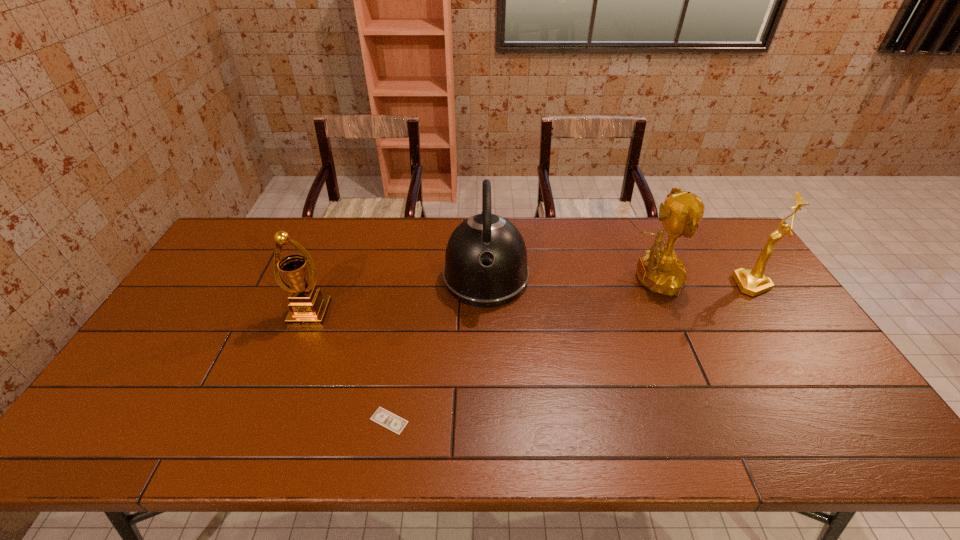
Locate an element on the screen. This screenshot has width=960, height=540. vacant space at the near edge of the desktop is located at coordinates (588, 432).

Identify the location of vacant area at the left edge. The width and height of the screenshot is (960, 540). (214, 302).

Where is `free location at the right edge`? Image resolution: width=960 pixels, height=540 pixels. free location at the right edge is located at coordinates (746, 325).

Identify the location of free space at the near left corner. This screenshot has height=540, width=960. (115, 434).

The width and height of the screenshot is (960, 540). What are the coordinates of `vacant space at the far right corner of the desktop` in the screenshot? It's located at (731, 246).

In the image, there is a desktop. At what (x,y) coordinates should I click in order to perform the action: click on vacant space at the near right corner. Please return your answer as a coordinate pair (x, y). This screenshot has height=540, width=960. Looking at the image, I should click on (827, 443).

Identify the location of free space that is in between the rightmost award and the leftmost object. (531, 299).

Identify the location of empty location between the third object from left to right and the leftmost object. (398, 295).

Find the location of a particular element. vacant area that lies between the third object from right to left and the leftmost object is located at coordinates (398, 295).

Where is `free space that is in between the second object from right to left and the fourth object from right to left`? The width and height of the screenshot is (960, 540). free space that is in between the second object from right to left and the fourth object from right to left is located at coordinates (519, 350).